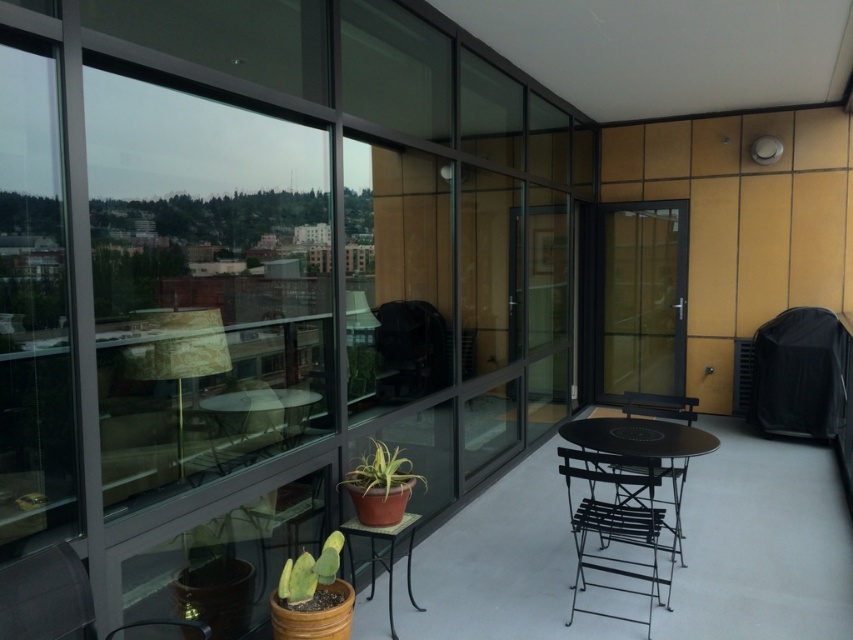
Question: Can you confirm if transparent glass door at center-right is positioned below black metal chair at center?

Choices:
 (A) yes
 (B) no

Answer: (B)

Question: Considering the real-world distances, which object is farthest from the transparent glass door at center-right?

Choices:
 (A) green matte cactus at lower left
 (B) black metal chair at center
 (C) black metal table at center

Answer: (A)

Question: Is transparent glass door at center-right bigger than matte glass table at center?

Choices:
 (A) no
 (B) yes

Answer: (B)

Question: Considering the real-world distances, which object is closest to the transparent glass door at center-right?

Choices:
 (A) matte glass table at center
 (B) matte terracotta pot at center

Answer: (A)

Question: Which point appears farthest from the camera in this image?

Choices:
 (A) (314, 589)
 (B) (347, 552)

Answer: (B)

Question: Observing the image, what is the correct spatial positioning of matte glass table at center in reference to green matte cactus at lower left?

Choices:
 (A) right
 (B) left

Answer: (B)